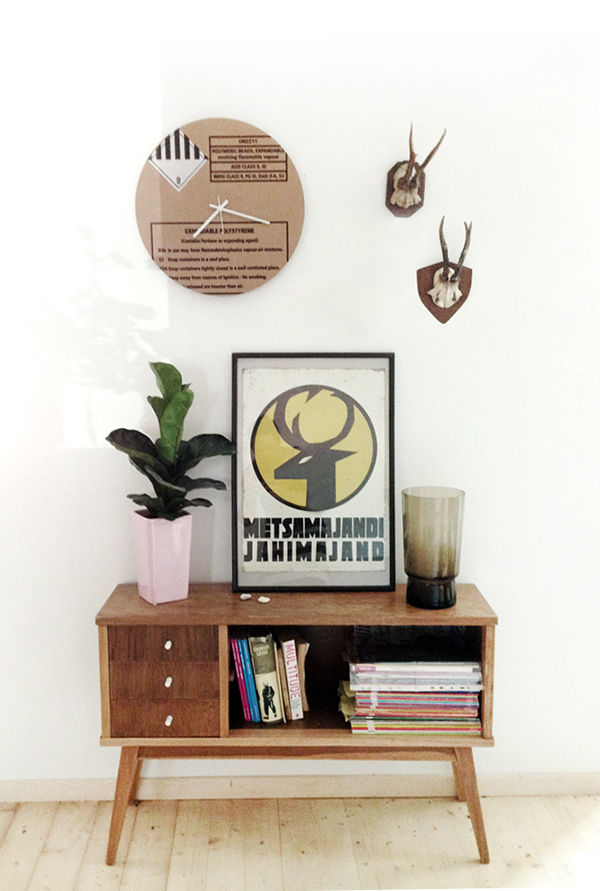
Where is `books`? The width and height of the screenshot is (600, 891). books is located at coordinates (235, 680), (252, 680), (273, 680), (286, 680), (291, 680), (395, 673), (395, 680), (395, 697), (395, 713).